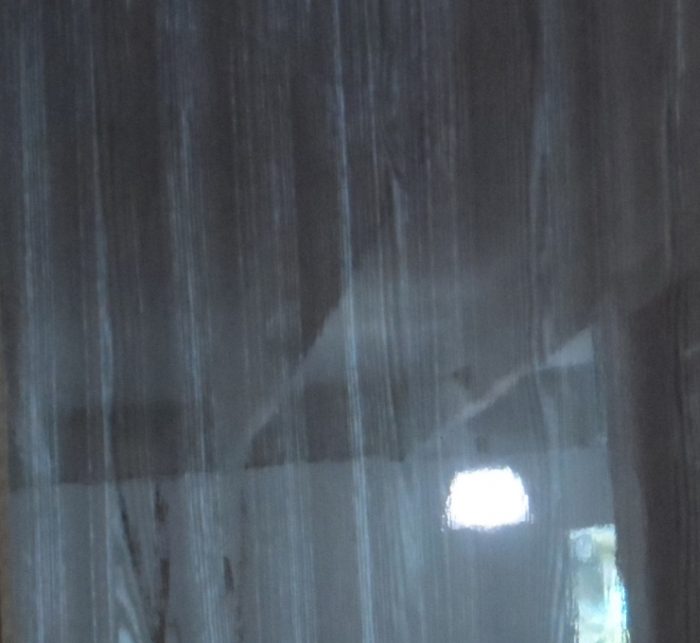
The width and height of the screenshot is (700, 643). What are the coordinates of `open door` in the screenshot? It's located at (596, 580), (598, 613).